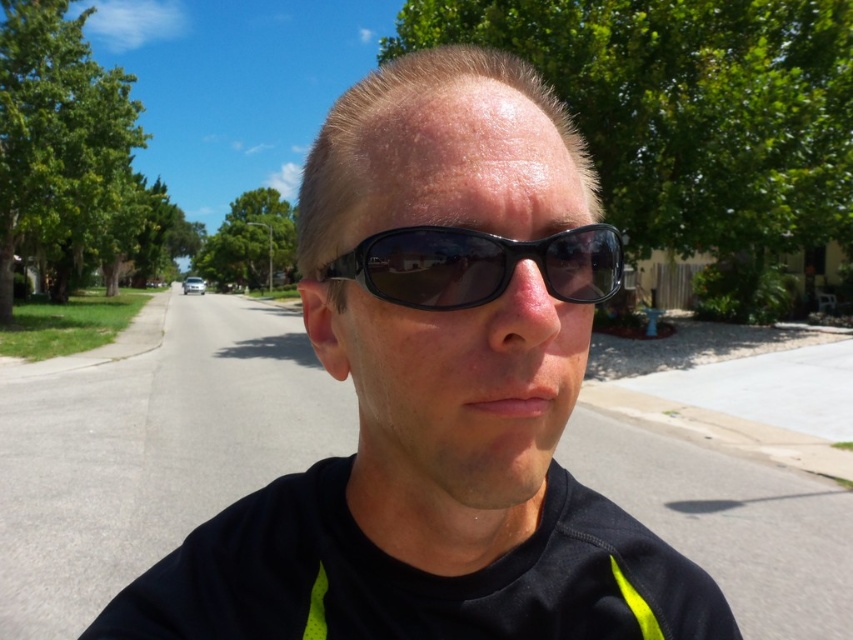
Is black matte sunglasses at center shorter than black plastic sunglasses at center?

Incorrect, black matte sunglasses at center's height does not fall short of black plastic sunglasses at center's.

Can you confirm if black matte sunglasses at center is positioned above black plastic sunglasses at center?

No.

Who is more forward, (511, 77) or (409, 246)?

Point (409, 246) is more forward.

Where is `black matte sunglasses at center`? The image size is (853, 640). black matte sunglasses at center is located at coordinates (438, 396).